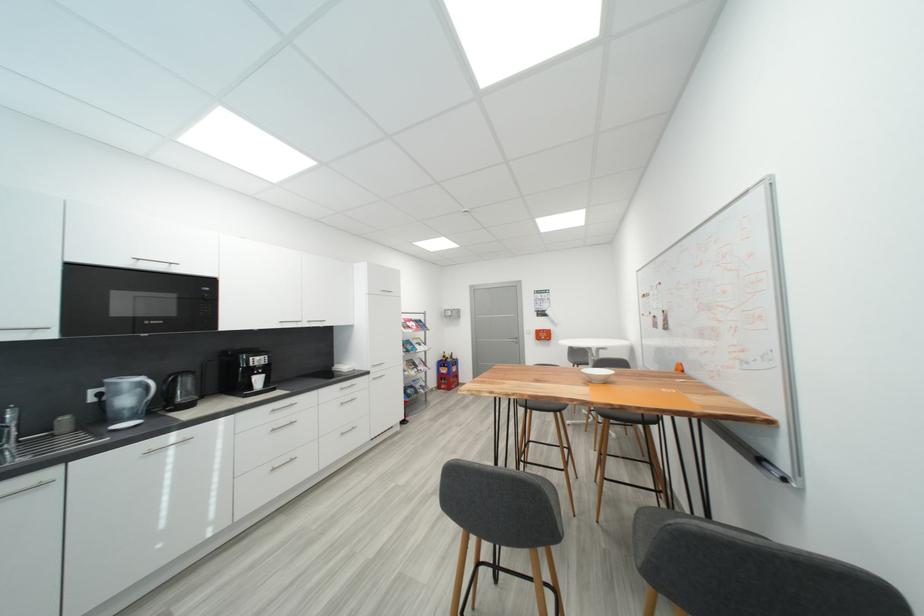
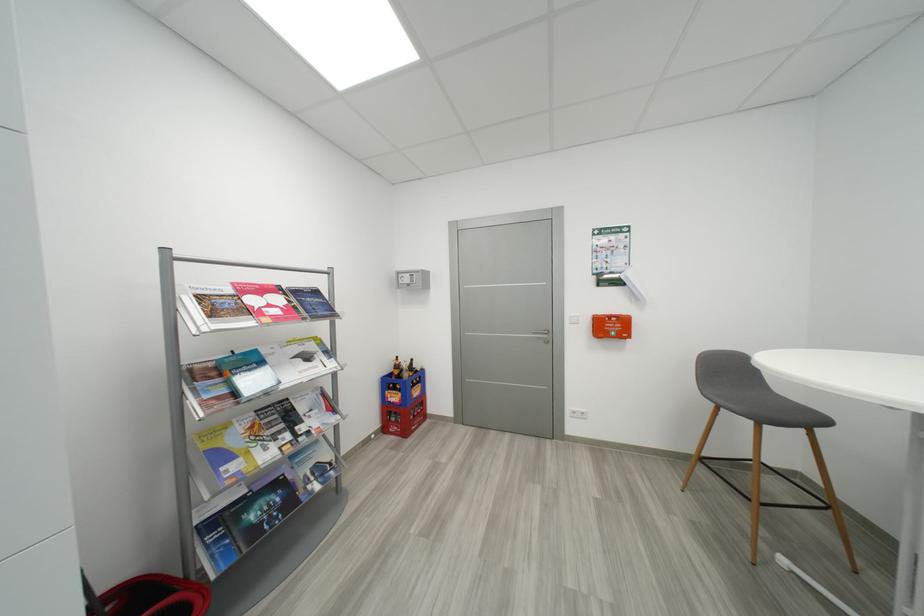
The point at (422, 371) is marked in the first image. Where is the corresponding point in the second image?

(294, 438)